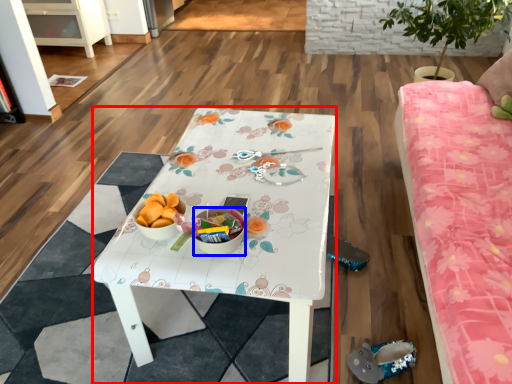
Question: Which of the following is the closest to the observer, desk (highlighted by a red box) or glass bowl (highlighted by a blue box)?

Choices:
 (A) desk
 (B) glass bowl

Answer: (A)